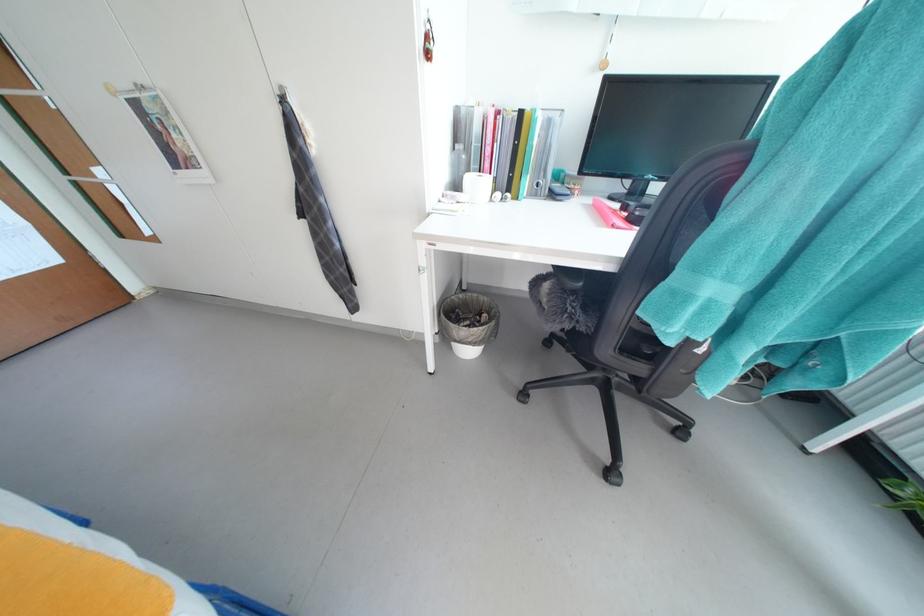
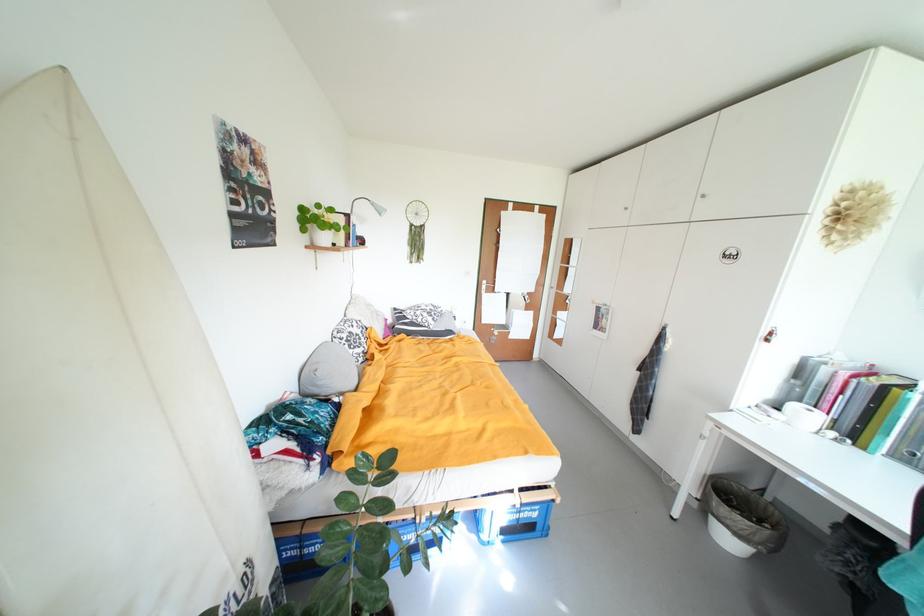
Locate, in the second image, the point that corresponds to (x=488, y=187) in the first image.

(817, 419)